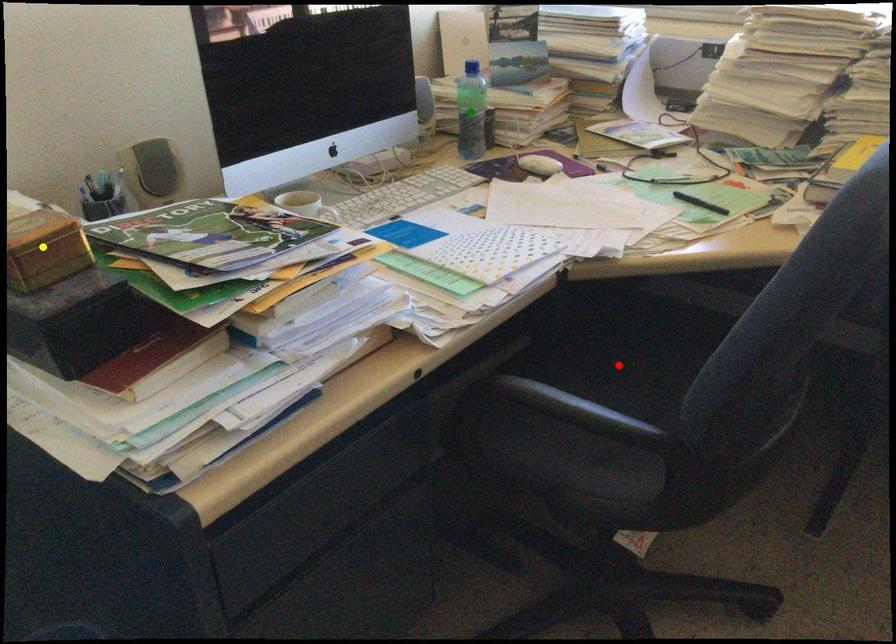
Order these from nearest to farthest:
- green point
- red point
- yellow point

yellow point, red point, green point